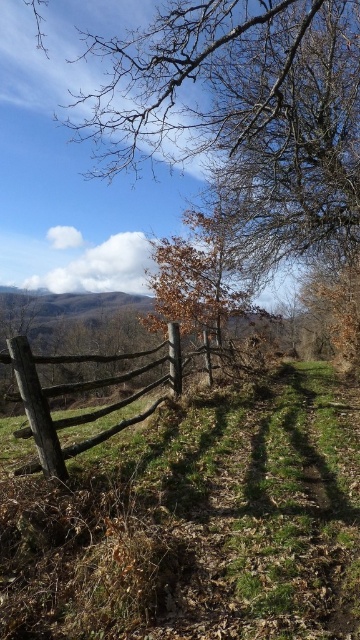
You are standing at the point labeled as point (342, 172) in the image. You want to walk to the nearest tree. Which direction should you walk to reach the nearest tree?

The point (342, 172) is 34.83 feet away from the nearest tree. Since the distance is given, you should walk towards the nearest tree in the direction of the tree located at the left side of the fence as it is closer than the one on the right.

You are a painter setting up your easel in the middle of the scene. You want to paint both the brown matte tree at center and the rustic wooden fence at center. Which object should you focus on first if you want to capture the wider subject?

The brown matte tree at center is wider than the rustic wooden fence at center, so you should focus on painting the brown matte tree at center first to capture the wider subject.

Consider the image. You are standing in the rural landscape and want to take a photo of the brown wood tree at upper center and the rustic wooden fence at center. Which object appears higher in the image?

The brown wood tree at upper center appears higher in the image than the rustic wooden fence at center because it is positioned above it according to the description.